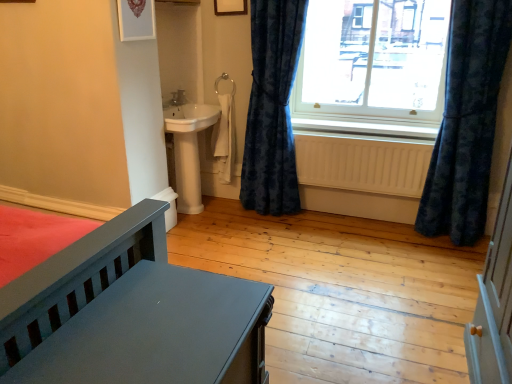
Describe the element at coordinates (272, 108) in the screenshot. The height and width of the screenshot is (384, 512). I see `velvet blue curtain at right, positioned as the first curtain in left-to-right order` at that location.

In order to click on matte gray bed at lower left in this screenshot , I will do `click(129, 313)`.

Is white painted wood at lower center to the left of beige wooden radiator at lower center from the viewer's perspective?

Yes, white painted wood at lower center is to the left of beige wooden radiator at lower center.

Does white painted wood at lower center turn towards beige wooden radiator at lower center?

No, white painted wood at lower center is not turned towards beige wooden radiator at lower center.

Can you confirm if white painted wood at lower center is taller than beige wooden radiator at lower center?

Incorrect, the height of white painted wood at lower center is not larger of that of beige wooden radiator at lower center.

Is white painted wood at lower center bigger than beige wooden radiator at lower center?

No, white painted wood at lower center is not bigger than beige wooden radiator at lower center.

Which point is more forward, (302, 3) or (311, 149)?

The point (302, 3) is closer.

Locate an element on the screen. radiator that appears below the velvet blue curtain at right, positioned as the first curtain in left-to-right order (from the image's perspective) is located at coordinates (362, 164).

Based on their positions, is velvet blue curtain at right, which ranks as the second curtain in right-to-left order, located to the left or right of beige wooden radiator at lower center?

Based on their positions, velvet blue curtain at right, which ranks as the second curtain in right-to-left order, is located to the left of beige wooden radiator at lower center.

From a real-world perspective, is velvet blue curtain at right, positioned as the first curtain in left-to-right order, above or below beige wooden radiator at lower center?

Clearly, from a real-world perspective, velvet blue curtain at right, positioned as the first curtain in left-to-right order, is above beige wooden radiator at lower center.

Looking at their sizes, would you say matte gray bed at lower left is wider or thinner than velvet dark blue curtain at right, which appears as the first curtain when viewed from the right?

Considering their sizes, matte gray bed at lower left looks broader than velvet dark blue curtain at right, which appears as the first curtain when viewed from the right.

Considering the points (68, 337) and (468, 235), which point is behind, point (68, 337) or point (468, 235)?

Positioned behind is point (468, 235).

How far apart are matte gray bed at lower left and velvet dark blue curtain at right, acting as the 2th curtain starting from the left?

matte gray bed at lower left and velvet dark blue curtain at right, acting as the 2th curtain starting from the left, are 6.79 feet apart from each other.

From the image's perspective, is matte gray bed at lower left positioned above or below velvet dark blue curtain at right, acting as the 2th curtain starting from the left?

Clearly, from the image's perspective, matte gray bed at lower left is below velvet dark blue curtain at right, acting as the 2th curtain starting from the left.

From a real-world perspective, who is located higher, velvet dark blue curtain at right, acting as the 2th curtain starting from the left, or beige wooden radiator at lower center?

velvet dark blue curtain at right, acting as the 2th curtain starting from the left, is physically above.

Does point (454, 106) come in front of point (334, 144)?

Yes, point (454, 106) is in front of point (334, 144).

Which is more to the right, velvet dark blue curtain at right, which appears as the first curtain when viewed from the right, or beige wooden radiator at lower center?

velvet dark blue curtain at right, which appears as the first curtain when viewed from the right.

Is velvet dark blue curtain at right, which appears as the first curtain when viewed from the right, in front of beige wooden radiator at lower center?

That is True.

Which point is more distant from viewer, (313, 108) or (4, 320)?

Point (313, 108)

Can you tell me how much transparent glass window at upper right and matte gray bed at lower left differ in facing direction?

The facing directions of transparent glass window at upper right and matte gray bed at lower left are 89.5 degrees apart.

Who is taller, transparent glass window at upper right or matte gray bed at lower left?

transparent glass window at upper right is taller.

Choose the correct answer: Is transparent glass window at upper right inside matte gray bed at lower left or outside it?

The correct answer is: outside.

Who is bigger, transparent glass window at upper right or white painted wood at lower center?

transparent glass window at upper right.

Considering the relative sizes of transparent glass window at upper right and white painted wood at lower center in the image provided, is transparent glass window at upper right wider than white painted wood at lower center?

Incorrect, the width of transparent glass window at upper right does not surpass that of white painted wood at lower center.

Which is correct: transparent glass window at upper right is inside white painted wood at lower center, or outside of it?

transparent glass window at upper right lies outside white painted wood at lower center.

Locate an element on the screen. This screenshot has height=384, width=512. window sill below the transparent glass window at upper right (from a real-world perspective) is located at coordinates (364, 129).

Based on their sizes in the image, would you say beige wooden radiator at lower center is bigger or smaller than velvet dark blue curtain at right, which appears as the first curtain when viewed from the right?

Considering their sizes, beige wooden radiator at lower center takes up less space than velvet dark blue curtain at right, which appears as the first curtain when viewed from the right.

Is beige wooden radiator at lower center behind velvet dark blue curtain at right, acting as the 2th curtain starting from the left?

Yes, the depth of beige wooden radiator at lower center is greater than that of velvet dark blue curtain at right, acting as the 2th curtain starting from the left.

From a real-world perspective, between beige wooden radiator at lower center and velvet dark blue curtain at right, acting as the 2th curtain starting from the left, who is vertically lower?

Answer: beige wooden radiator at lower center.

Can you confirm if beige wooden radiator at lower center is taller than velvet dark blue curtain at right, acting as the 2th curtain starting from the left?

No.

Locate an element on the screen. The width and height of the screenshot is (512, 384). window sill to the left of beige wooden radiator at lower center is located at coordinates (364, 129).

From the image's perspective, starting from the beige wooden radiator at lower center, which curtain is the 2nd one above? Please provide its 2D coordinates.

[(272, 108)]

From the image, which object appears to be farther from matte gray bed at lower left, velvet dark blue curtain at right, which appears as the first curtain when viewed from the right, or beige wooden radiator at lower center?

velvet dark blue curtain at right, which appears as the first curtain when viewed from the right.

When comparing their distances from velvet dark blue curtain at right, acting as the 2th curtain starting from the left, does beige wooden radiator at lower center or matte gray bed at lower left seem further?

matte gray bed at lower left.

Estimate the real-world distances between objects in this image. Which object is closer to matte gray bed at lower left, velvet blue curtain at right, positioned as the first curtain in left-to-right order, or beige wooden radiator at lower center?

Among the two, velvet blue curtain at right, positioned as the first curtain in left-to-right order, is located nearer to matte gray bed at lower left.

Which object lies nearer to the anchor point velvet blue curtain at right, positioned as the first curtain in left-to-right order, transparent glass window at upper right or velvet dark blue curtain at right, acting as the 2th curtain starting from the left?

Among the two, transparent glass window at upper right is located nearer to velvet blue curtain at right, positioned as the first curtain in left-to-right order.

Looking at the image, which one is located further to white painted wood at lower center, beige wooden radiator at lower center or velvet blue curtain at right, which ranks as the second curtain in right-to-left order?

velvet blue curtain at right, which ranks as the second curtain in right-to-left order.

Based on their spatial positions, is velvet dark blue curtain at right, which appears as the first curtain when viewed from the right, or velvet blue curtain at right, which ranks as the second curtain in right-to-left order, further from white painted wood at lower center?

Among the two, velvet dark blue curtain at right, which appears as the first curtain when viewed from the right, is located further to white painted wood at lower center.

Estimate the real-world distances between objects in this image. Which object is further from velvet blue curtain at right, positioned as the first curtain in left-to-right order, matte gray bed at lower left or velvet dark blue curtain at right, acting as the 2th curtain starting from the left?

The object further to velvet blue curtain at right, positioned as the first curtain in left-to-right order, is matte gray bed at lower left.

Estimate the real-world distances between objects in this image. Which object is further from transparent glass window at upper right, beige wooden radiator at lower center or matte gray bed at lower left?

Based on the image, matte gray bed at lower left appears to be further to transparent glass window at upper right.

Where is `radiator between velvet blue curtain at right, positioned as the first curtain in left-to-right order, and transparent glass window at upper right`? radiator between velvet blue curtain at right, positioned as the first curtain in left-to-right order, and transparent glass window at upper right is located at coordinates (362, 164).

Identify the location of window between velvet dark blue curtain at right, acting as the 2th curtain starting from the left, and white painted wood at lower center from front to back. (373, 60).

I want to click on window sill between velvet blue curtain at right, positioned as the first curtain in left-to-right order, and transparent glass window at upper right from left to right, so click(364, 129).

I want to click on window sill situated between velvet blue curtain at right, positioned as the first curtain in left-to-right order, and velvet dark blue curtain at right, acting as the 2th curtain starting from the left, from left to right, so click(364, 129).